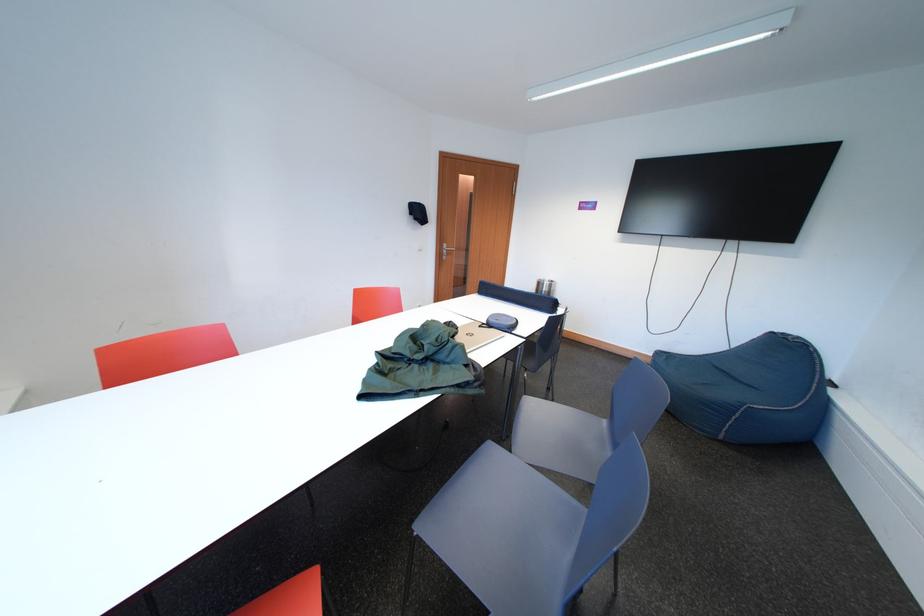
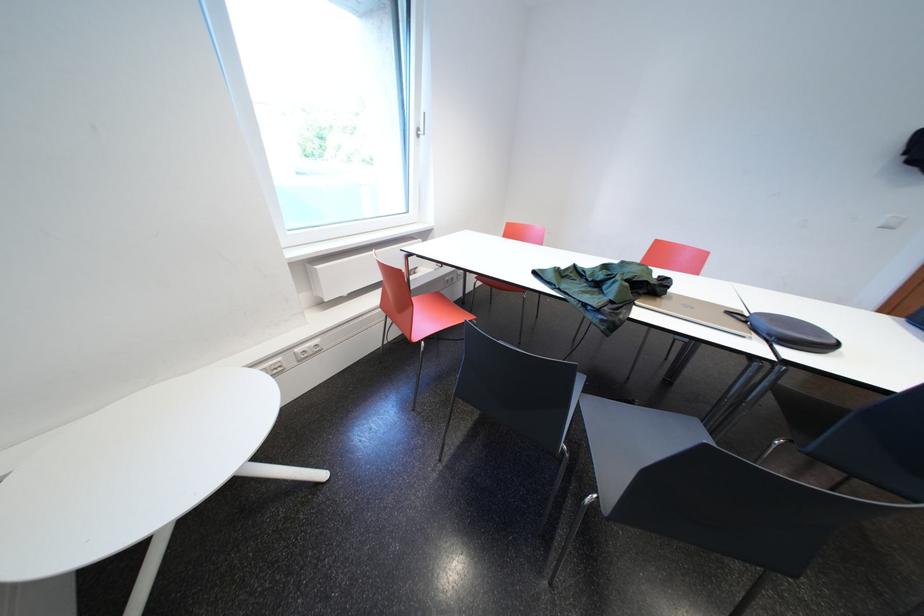
First-person continuous shooting, in which direction is the camera rotating?

The camera's rotation is toward left-down.